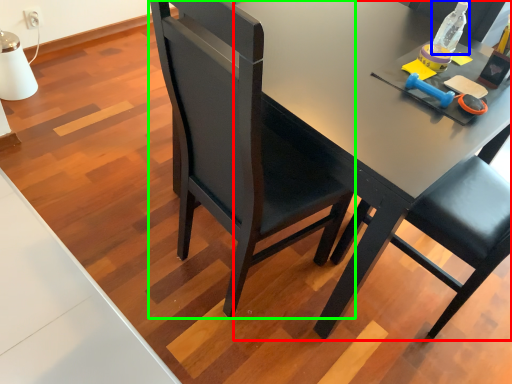
Question: Which is farther away from desk (highlighted by a red box)? bottle (highlighted by a blue box) or chair (highlighted by a green box)?

Choices:
 (A) bottle
 (B) chair

Answer: (A)